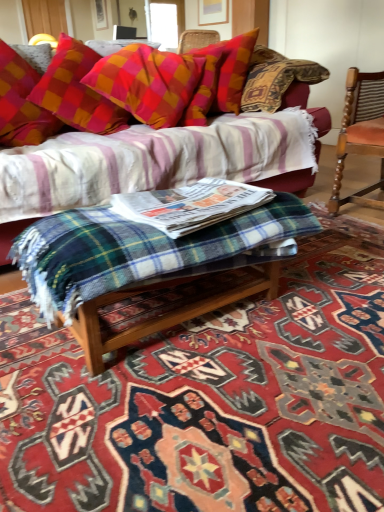
The image size is (384, 512). Find the location of `empty space that is ontop of plaid woolen blanket at center (from a real-world perspective)`. empty space that is ontop of plaid woolen blanket at center (from a real-world perspective) is located at coordinates (253, 349).